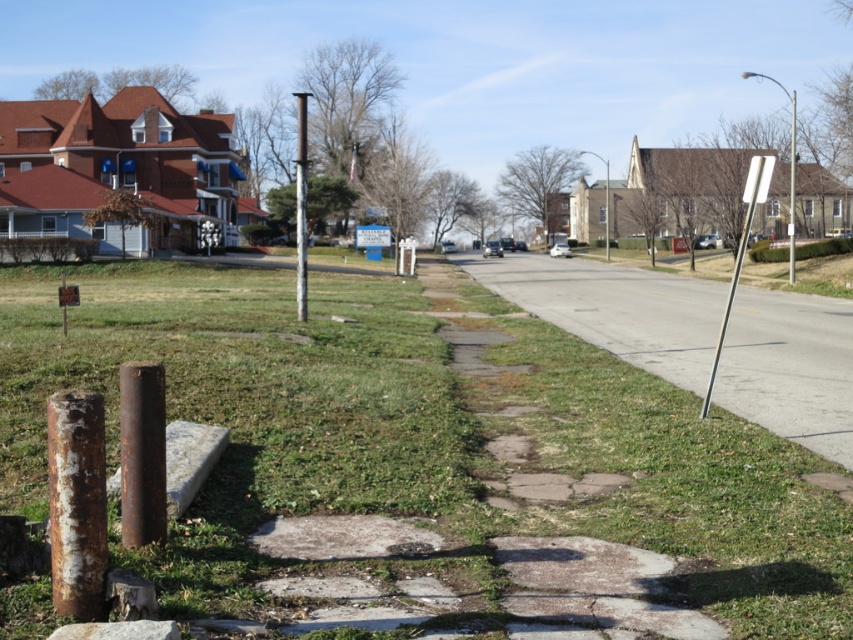
You are a delivery driver who needs to park your truck on the gray asphalt road at center. However, there is a rusty metal pole at center nearby. Based on the scene, will the pole interfere with parking your truck?

The gray asphalt road at center is not as tall as the rusty metal pole at center, meaning the pole is taller than the road. Since the road itself is flat ground, the height of the pole would not interfere with parking the truck on the road unless the pole is in the path. However, the description does not mention the pole being in the path, so the height alone would not prevent parking.

You are a delivery person who needs to cross the street from the rusty metal pole at center to the other side. The street is 21.18 meters wide. Can you safely cross it within 30 seconds if you walk at 1.5 meters per second?

The distance between the rusty metal pole at center and the other side is 21.18 meters. At a walking speed of 1.5 meters per second, it would take approximately 14.12 seconds to cross. Since this is under 30 seconds, you can safely cross within the time limit.